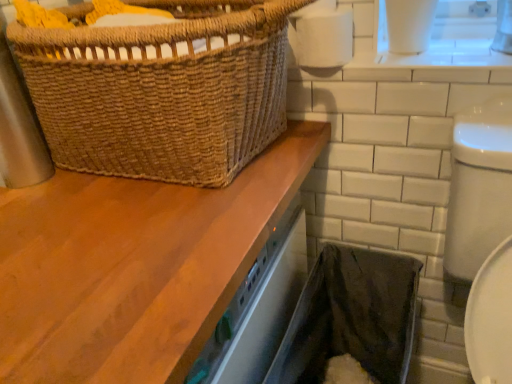
Question: From the image's perspective, is brown woven basket at upper left on top of white matte toilet paper at upper right?

Choices:
 (A) yes
 (B) no

Answer: (B)

Question: Is brown woven basket at upper left in front of white matte toilet paper at upper right?

Choices:
 (A) no
 (B) yes

Answer: (B)

Question: From the image's perspective, is brown woven basket at upper left below white matte toilet paper at upper right?

Choices:
 (A) no
 (B) yes

Answer: (B)

Question: Are brown woven basket at upper left and white matte toilet paper at upper right making contact?

Choices:
 (A) no
 (B) yes

Answer: (A)

Question: Is brown woven basket at upper left taller than white matte toilet paper at upper right?

Choices:
 (A) no
 (B) yes

Answer: (B)

Question: Can you confirm if brown woven basket at upper left is positioned to the right of white matte toilet paper at upper right?

Choices:
 (A) yes
 (B) no

Answer: (B)

Question: From the image's perspective, would you say wooden countertop at upper left is positioned over white matte toilet paper at upper right?

Choices:
 (A) no
 (B) yes

Answer: (A)

Question: Could white matte toilet paper at upper right be considered to be inside wooden countertop at upper left?

Choices:
 (A) yes
 (B) no

Answer: (B)

Question: Does wooden countertop at upper left appear on the right side of white matte toilet paper at upper right?

Choices:
 (A) yes
 (B) no

Answer: (B)

Question: From a real-world perspective, is wooden countertop at upper left located beneath white matte toilet paper at upper right?

Choices:
 (A) no
 (B) yes

Answer: (B)

Question: Is wooden countertop at upper left not near white matte toilet paper at upper right?

Choices:
 (A) yes
 (B) no

Answer: (B)

Question: Does wooden countertop at upper left have a larger size compared to white matte toilet paper at upper right?

Choices:
 (A) yes
 (B) no

Answer: (A)

Question: Can we say black fabric laundry basket at lower right lies outside brown woven basket at upper left?

Choices:
 (A) yes
 (B) no

Answer: (A)